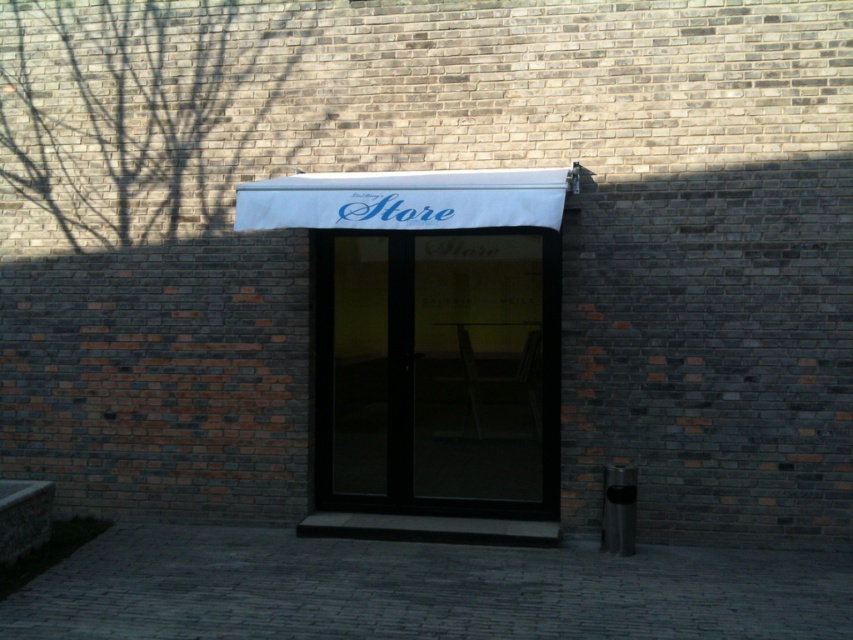
Question: Which point is closer to the camera?

Choices:
 (A) (424, 416)
 (B) (288, 179)

Answer: (B)

Question: Which object appears farthest from the camera in this image?

Choices:
 (A) white fabric store sign at center
 (B) transparent glass door at center

Answer: (B)

Question: In this image, where is transparent glass door at center located relative to white fabric store sign at center?

Choices:
 (A) right
 (B) left

Answer: (A)

Question: Does transparent glass door at center lie behind white fabric store sign at center?

Choices:
 (A) yes
 (B) no

Answer: (A)

Question: Is transparent glass door at center behind white fabric store sign at center?

Choices:
 (A) yes
 (B) no

Answer: (A)